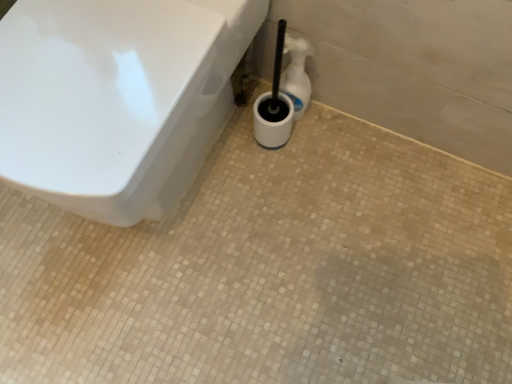
Question: Is white plastic bottle at center spatially inside white glossy toilet at upper left, or outside of it?

Choices:
 (A) outside
 (B) inside

Answer: (A)

Question: From a real-world perspective, is white plastic bottle at center physically located above or below white glossy toilet at upper left?

Choices:
 (A) below
 (B) above

Answer: (A)

Question: Considering the positions of white plastic bottle at center and white glossy toilet at upper left in the image, is white plastic bottle at center wider or thinner than white glossy toilet at upper left?

Choices:
 (A) wide
 (B) thin

Answer: (B)

Question: Is white glossy toilet at upper left to the left or to the right of white plastic bottle at center in the image?

Choices:
 (A) right
 (B) left

Answer: (B)

Question: In terms of width, does white glossy toilet at upper left look wider or thinner when compared to white plastic bottle at center?

Choices:
 (A) wide
 (B) thin

Answer: (A)

Question: Is white glossy toilet at upper left spatially inside white plastic bottle at center, or outside of it?

Choices:
 (A) outside
 (B) inside

Answer: (A)

Question: Considering the positions of white glossy toilet at upper left and white plastic bottle at center in the image, is white glossy toilet at upper left taller or shorter than white plastic bottle at center?

Choices:
 (A) short
 (B) tall

Answer: (B)